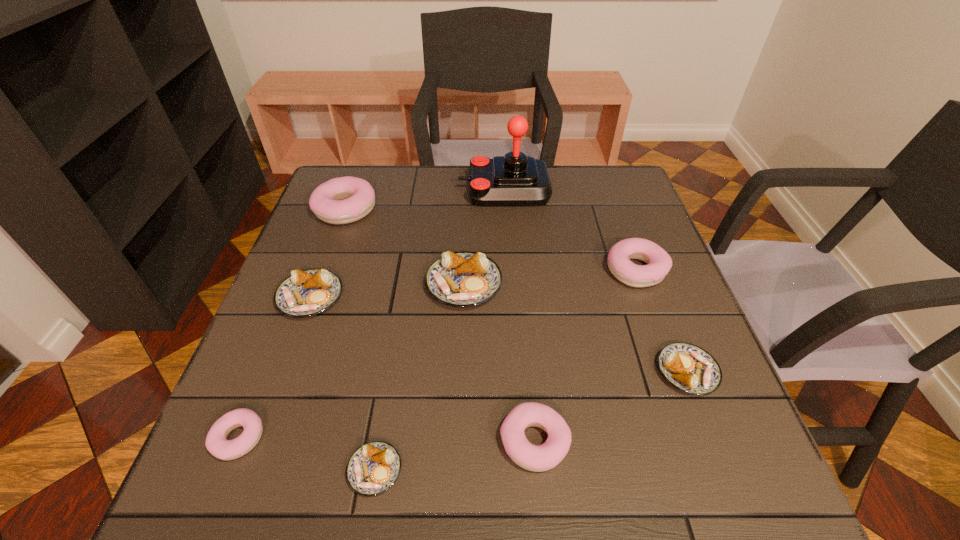
What are the coordinates of `free location located on the right of the second pink pastry from right to left` in the screenshot? It's located at (707, 441).

This screenshot has width=960, height=540. I want to click on vacant point located 0.140m on the front of the third biggest brown pastry, so pos(727,475).

Locate an element on the screen. vacant space situated 0.190m on the back of the smallest pink pastry is located at coordinates (281, 332).

In order to click on free space located 0.220m on the back of the smallest brown pastry in this screenshot , I will do `click(396, 341)`.

In order to click on joystick that is at the far edge in this screenshot , I will do `click(515, 179)`.

Where is `pastry located in the far edge section of the desktop`? pastry located in the far edge section of the desktop is located at coordinates (342, 200).

Where is `object that is at the far left corner`? object that is at the far left corner is located at coordinates (342, 200).

At what (x,y) coordinates should I click in order to perform the action: click on object that is at the near left corner. Please return your answer as a coordinate pair (x, y). This screenshot has width=960, height=540. Looking at the image, I should click on (216, 443).

In the image, there is a desktop. Where is `vacant area at the far edge`? Image resolution: width=960 pixels, height=540 pixels. vacant area at the far edge is located at coordinates (433, 182).

The width and height of the screenshot is (960, 540). I want to click on free region at the near edge of the desktop, so [459, 497].